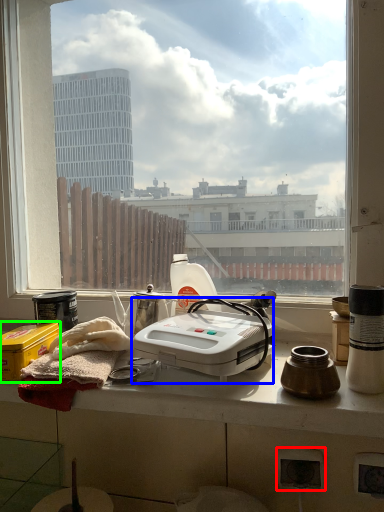
Question: Based on their relative distances, which object is nearer to power plugs and sockets (highlighted by a red box)? Choose from kitchen appliance (highlighted by a blue box) and box (highlighted by a green box).

Choices:
 (A) kitchen appliance
 (B) box

Answer: (A)